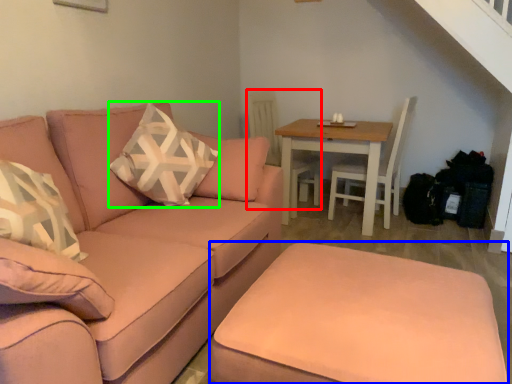
Question: Which object is positioned closest to swivel chair (highlighted by a red box)? Select from footrest (highlighted by a blue box) and throw pillow (highlighted by a green box).

Choices:
 (A) footrest
 (B) throw pillow

Answer: (B)